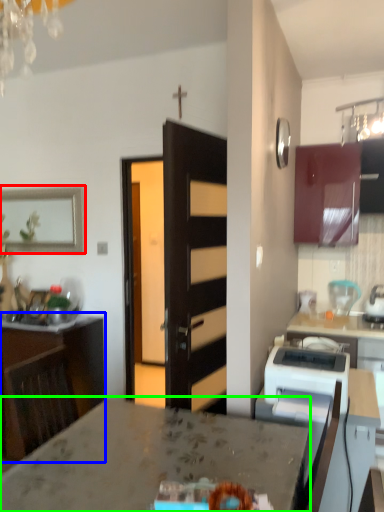
Question: Estimate the real-world distances between objects in this image. Which object is closer to picture frame (highlighted by a red box), cabinetry (highlighted by a blue box) or countertop (highlighted by a green box)?

Choices:
 (A) cabinetry
 (B) countertop

Answer: (A)